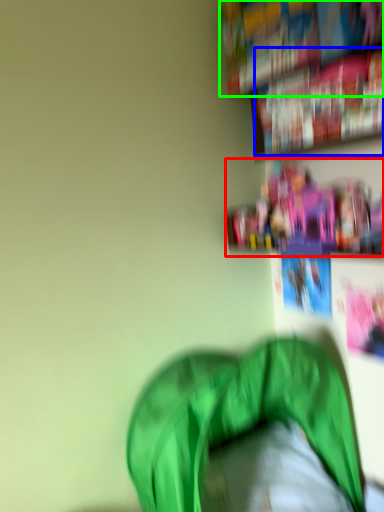
Question: Which is farther away from shelf (highlighted by a red box)? book (highlighted by a blue box) or book (highlighted by a green box)?

Choices:
 (A) book
 (B) book

Answer: (B)